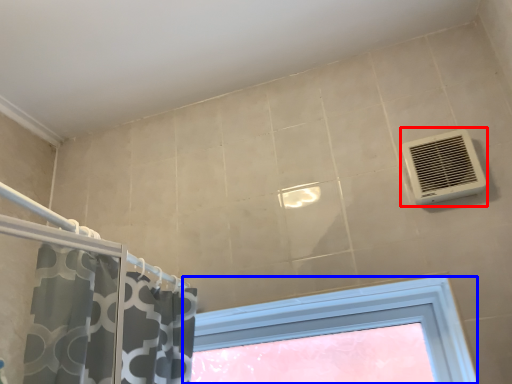
Question: Among these objects, which one is farthest to the camera, air conditioning (highlighted by a red box) or window (highlighted by a blue box)?

Choices:
 (A) air conditioning
 (B) window

Answer: (B)